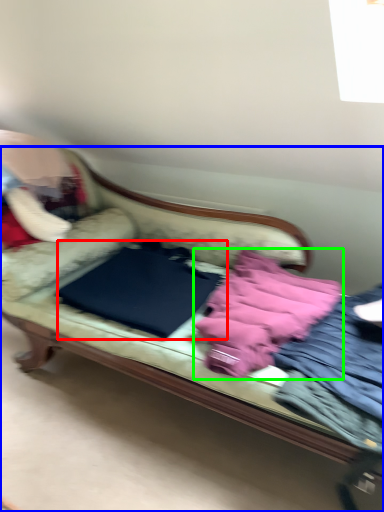
Question: Which object is positioned farthest from sheet (highlighted by a red box)? Select from studio couch (highlighted by a blue box) and material (highlighted by a green box).

Choices:
 (A) studio couch
 (B) material

Answer: (B)